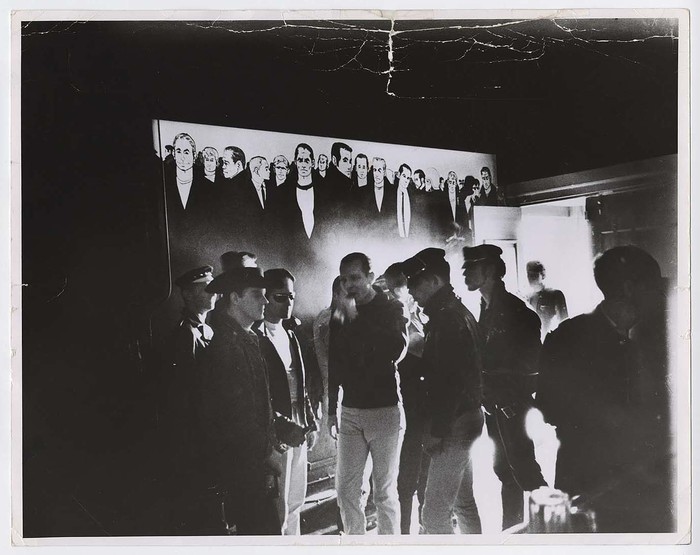
Where is `door`? door is located at coordinates (512, 225).